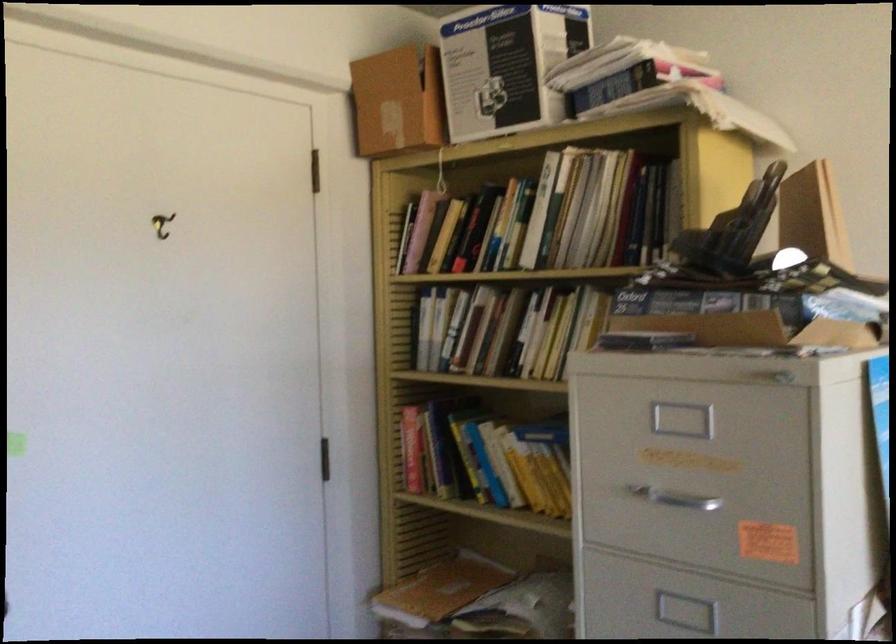
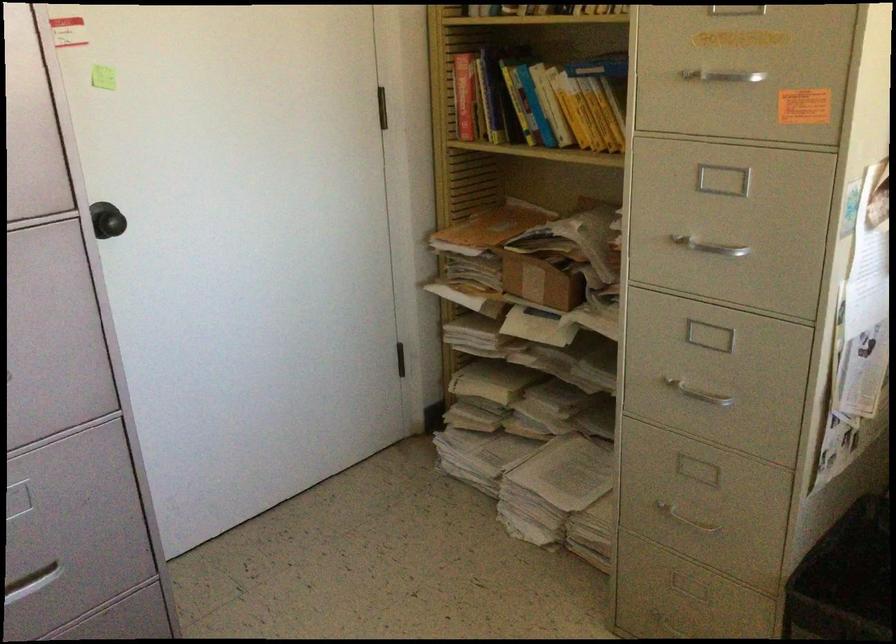
Where in the second image is the point corresponding to (x=679, y=504) from the first image?

(725, 82)